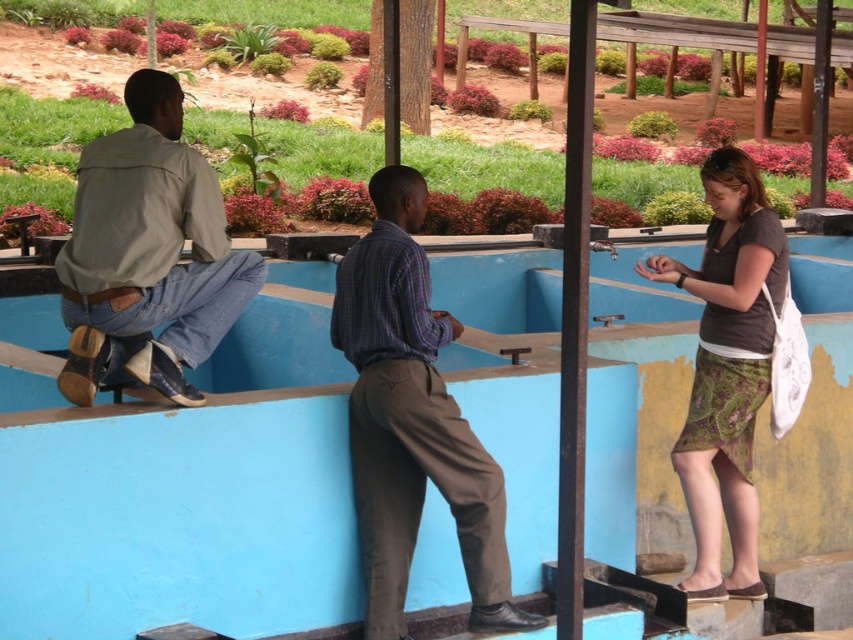
You are standing at the base of the blue structure and want to reach the point labeled point (699, 419). Which direction should you move relative to the point labeled point (135, 374)?

You should move away from point (135, 374) because point (699, 419) is further from the camera compared to point (135, 374).